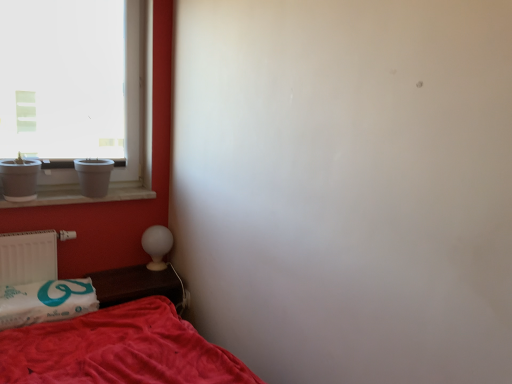
Find the location of a particular element. The height and width of the screenshot is (384, 512). brown wooden table at lower left is located at coordinates (138, 285).

What is the approximate height of white glossy table lamp at lower left?

white glossy table lamp at lower left is 10.08 inches tall.

Measure the distance between point (x=6, y=313) and camera.

6.20 feet.

Where is `white marble window sill at left`? The image size is (512, 384). white marble window sill at left is located at coordinates (81, 194).

Identify the location of brown wooden table at lower left. (138, 285).

In the image, is white glossy table lamp at lower left positioned in front of or behind white soft pillow at lower left?

In the image, white glossy table lamp at lower left appears behind white soft pillow at lower left.

Image resolution: width=512 pixels, height=384 pixels. Find the location of `pillow located underneath the white glossy table lamp at lower left (from a real-world perspective)`. pillow located underneath the white glossy table lamp at lower left (from a real-world perspective) is located at coordinates (46, 301).

Which point is more distant from viewer, (x=165, y=236) or (x=75, y=313)?

Point (x=165, y=236)

How much distance is there between brown wooden table at lower left and white soft pillow at lower left?

The distance of brown wooden table at lower left from white soft pillow at lower left is 10.07 inches.

Is brown wooden table at lower left not close to white soft pillow at lower left?

No, brown wooden table at lower left is in close proximity to white soft pillow at lower left.

Considering the sizes of objects brown wooden table at lower left and white soft pillow at lower left in the image provided, who is shorter, brown wooden table at lower left or white soft pillow at lower left?

With less height is brown wooden table at lower left.

Is white glossy table lamp at lower left not within brown wooden table at lower left?

Yes, white glossy table lamp at lower left is located beyond the bounds of brown wooden table at lower left.

Does white glossy table lamp at lower left have a smaller size compared to brown wooden table at lower left?

Yes, white glossy table lamp at lower left is smaller than brown wooden table at lower left.

Where is `table lamp behind the brown wooden table at lower left`? The height and width of the screenshot is (384, 512). table lamp behind the brown wooden table at lower left is located at coordinates (157, 245).

From a real-world perspective, is white glossy table lamp at lower left positioned over brown wooden table at lower left based on gravity?

Yes, from a real-world perspective, white glossy table lamp at lower left is over brown wooden table at lower left

Considering the sizes of white soft pillow at lower left and brown wooden table at lower left in the image, is white soft pillow at lower left bigger or smaller than brown wooden table at lower left?

Clearly, white soft pillow at lower left is larger in size than brown wooden table at lower left.

From a real-world perspective, is white soft pillow at lower left physically below brown wooden table at lower left?

No, from a real-world perspective, white soft pillow at lower left is not under brown wooden table at lower left.

Which is behind, white soft pillow at lower left or brown wooden table at lower left?

brown wooden table at lower left is further away from the camera.

Which point is more forward, (67,308) or (106,282)?

The point (67,308) is closer.

Would you consider white matte window at upper left to be distant from brown wooden table at lower left?

No.

Which is more to the right, white matte window at upper left or brown wooden table at lower left?

Positioned to the right is brown wooden table at lower left.

Considering the sizes of white matte window at upper left and brown wooden table at lower left in the image, is white matte window at upper left bigger or smaller than brown wooden table at lower left?

In the image, white matte window at upper left appears to be larger than brown wooden table at lower left.

Considering the positions of points (56, 19) and (177, 305), is point (56, 19) closer to camera compared to point (177, 305)?

No.

Between point (37, 81) and point (23, 266), which one is positioned behind?

Positioned behind is point (37, 81).

Identify the location of window above the white matte radiator at lower left (from the image's perspective). The height and width of the screenshot is (384, 512). (75, 95).

Based on the photo, which object is closer to the camera, white matte window at upper left or white matte radiator at lower left?

white matte window at upper left is closer to the camera.

Could you tell me if white matte window at upper left is facing white matte radiator at lower left?

No, white matte window at upper left is not facing towards white matte radiator at lower left.

Is white marble window sill at left in front of or behind white glossy table lamp at lower left in the image?

Visually, white marble window sill at left is located in front of white glossy table lamp at lower left.

From the image's perspective, between white marble window sill at left and white glossy table lamp at lower left, which one is located above?

white marble window sill at left appears higher in the image.

Which is more to the left, white marble window sill at left or white glossy table lamp at lower left?

Positioned to the left is white marble window sill at left.

Considering the relative sizes of white marble window sill at left and white glossy table lamp at lower left in the image provided, is white marble window sill at left bigger than white glossy table lamp at lower left?

Yes.

Identify the location of table lamp that appears above the white soft pillow at lower left (from a real-world perspective). (157, 245).

I want to click on table above the white soft pillow at lower left (from the image's perspective), so click(x=138, y=285).

Consider the image. From the image, which object appears to be farther from white matte window at upper left, brown wooden table at lower left or white glossy table lamp at lower left?

Among the two, brown wooden table at lower left is located further to white matte window at upper left.

From the image, which object appears to be nearer to white glossy table lamp at lower left, white marble window sill at left or brown wooden table at lower left?

brown wooden table at lower left.

Estimate the real-world distances between objects in this image. Which object is closer to white matte radiator at lower left, white marble window sill at left or white soft pillow at lower left?

Among the two, white soft pillow at lower left is located nearer to white matte radiator at lower left.

In the scene shown: Considering their positions, is white matte radiator at lower left positioned closer to brown wooden table at lower left than white matte window at upper left?

The object closer to brown wooden table at lower left is white matte radiator at lower left.

Considering their positions, is white matte window at upper left positioned closer to brown wooden table at lower left than white glossy table lamp at lower left?

The object closer to brown wooden table at lower left is white glossy table lamp at lower left.

Based on their spatial positions, is white glossy table lamp at lower left or brown wooden table at lower left further from white matte radiator at lower left?

The object further to white matte radiator at lower left is white glossy table lamp at lower left.

Considering their positions, is white glossy table lamp at lower left positioned closer to white marble window sill at left than white matte window at upper left?

Among the two, white glossy table lamp at lower left is located nearer to white marble window sill at left.

In the scene shown: When comparing their distances from white marble window sill at left, does white glossy table lamp at lower left or white soft pillow at lower left seem closer?

white glossy table lamp at lower left.

In order to click on table lamp that lies between white matte window at upper left and brown wooden table at lower left from top to bottom in this screenshot , I will do pos(157,245).

You are a GUI agent. You are given a task and a screenshot of the screen. Output one action in this format:
    pyautogui.click(x=<x>, y=<y>)
    Task: Click on the table between white matte window at upper left and white soft pillow at lower left in the up-down direction
    
    Given the screenshot: What is the action you would take?
    pyautogui.click(x=138, y=285)

Locate an element on the screen. The width and height of the screenshot is (512, 384). table between white soft pillow at lower left and white glossy table lamp at lower left along the z-axis is located at coordinates (138, 285).

Locate an element on the screen. This screenshot has width=512, height=384. window sill between white matte window at upper left and brown wooden table at lower left in the up-down direction is located at coordinates (81, 194).